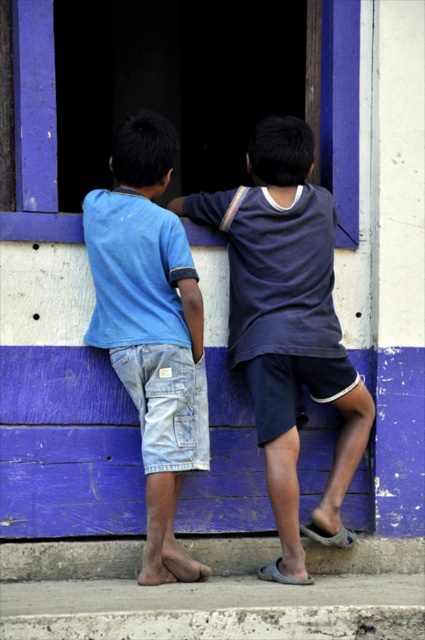
Question: Does dark blue cotton shirt at center come in front of blue wooden window at upper center?

Choices:
 (A) yes
 (B) no

Answer: (A)

Question: Is the position of light blue denim shorts at center less distant than that of blue wooden window at upper center?

Choices:
 (A) yes
 (B) no

Answer: (A)

Question: Can you confirm if light blue denim shorts at center is wider than blue wooden window at upper center?

Choices:
 (A) yes
 (B) no

Answer: (A)

Question: Which point appears farthest from the camera in this image?

Choices:
 (A) (343, 61)
 (B) (195, 288)

Answer: (A)

Question: Which of the following is the farthest from the observer?

Choices:
 (A) (175, 496)
 (B) (42, 52)
 (C) (342, 440)

Answer: (C)

Question: Estimate the real-world distances between objects in this image. Which object is closer to the dark blue cotton shirt at center?

Choices:
 (A) blue wooden window at upper center
 (B) light blue denim shorts at center

Answer: (B)